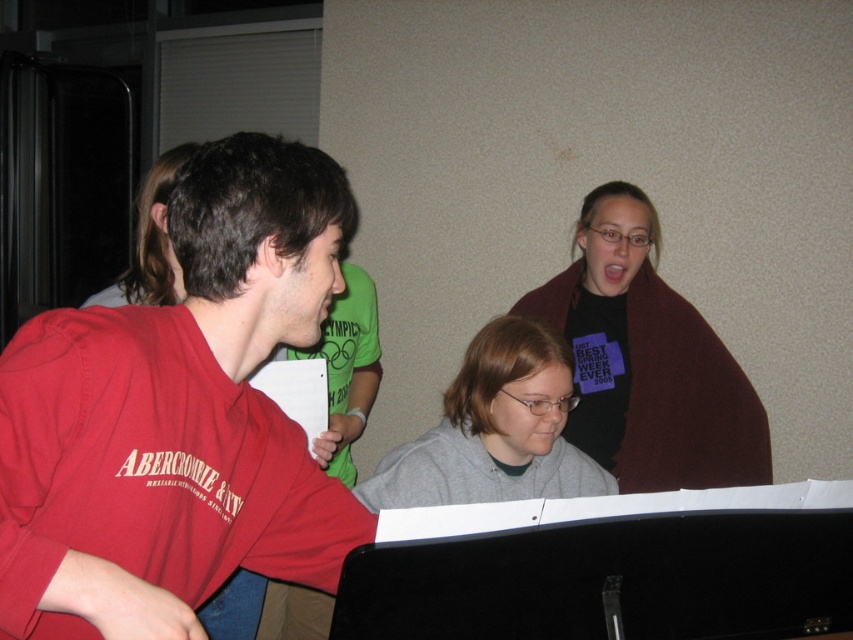
Measure the distance between point (26, 532) and camera.

The distance of point (26, 532) from camera is 29.75 inches.

Is matte red shirt at left shorter than maroon fleece blanket at upper right?

Correct, matte red shirt at left is not as tall as maroon fleece blanket at upper right.

Does point (161, 547) come closer to viewer compared to point (744, 404)?

Yes, point (161, 547) is in front of point (744, 404).

What are the coordinates of `matte red shirt at left` in the screenshot? It's located at (177, 417).

Does maroon fleece blanket at upper right come in front of gray matte hoodie at center?

No.

Can you confirm if maroon fleece blanket at upper right is positioned above gray matte hoodie at center?

Yes, maroon fleece blanket at upper right is above gray matte hoodie at center.

Between point (573, 308) and point (599, 492), which one is positioned behind?

The point (573, 308) is more distant.

Where is `maroon fleece blanket at upper right`? The height and width of the screenshot is (640, 853). maroon fleece blanket at upper right is located at coordinates (647, 360).

Between point (27, 342) and point (407, 474), which one is positioned in front?

Point (27, 342) is in front.

Does matte red shirt at left have a greater width compared to gray matte hoodie at center?

Incorrect, matte red shirt at left's width does not surpass gray matte hoodie at center's.

Which is behind, point (164, 420) or point (482, 449)?

Point (482, 449)

The image size is (853, 640). I want to click on matte red shirt at left, so click(x=177, y=417).